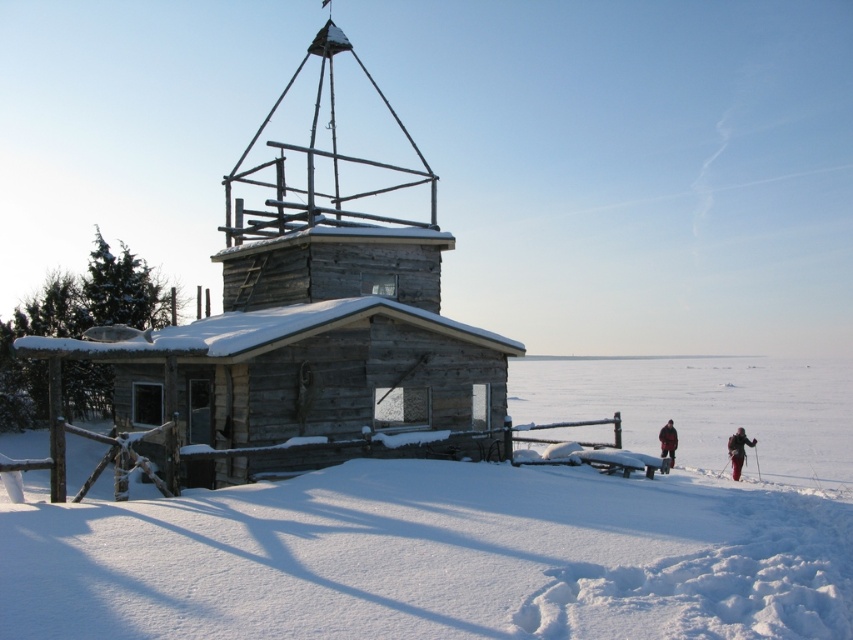
Based on the photo, you are an observer standing in front of the rustic wooden cabin in the snowy landscape. You notice two items at the lower right corner of the image. Which one is covering the other, the dark red ski suit at lower right or the dark red fabric jacket at lower right?

The dark red ski suit at lower right is positioned over the dark red fabric jacket at lower right, so the ski suit is covering the jacket.

You are standing in front of a rustic wooden cabin in the snow. You see a white snow at lower left and a dark red fabric jacket at lower right. Which object is bigger?

The white snow at lower left is larger than the dark red fabric jacket at lower right.